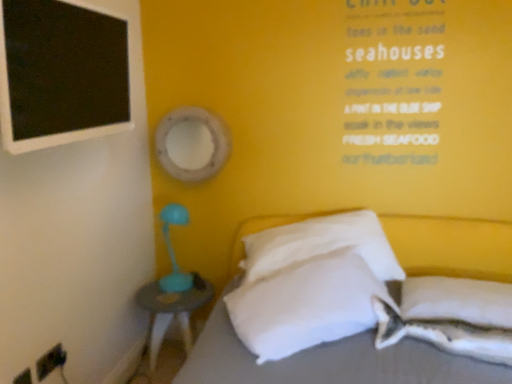
This screenshot has height=384, width=512. What are the coordinates of `white soft pillow at lower right, the 4th pillow from the left` in the screenshot? It's located at (457, 300).

The image size is (512, 384). What do you see at coordinates (329, 362) in the screenshot?
I see `white fabric bed at lower right` at bounding box center [329, 362].

From the picture: Measure the distance between white soft pillow at center, acting as the 4th pillow starting from the right, and camera.

The distance of white soft pillow at center, acting as the 4th pillow starting from the right, from camera is 1.58 meters.

The image size is (512, 384). What do you see at coordinates (62, 73) in the screenshot?
I see `black matte board at upper left` at bounding box center [62, 73].

I want to click on teal plastic nightstand at lower left, so click(x=172, y=311).

Considering the sizes of objects white soft pillow at lower right, which is the third pillow from left to right, and white soft pillow at lower right, the 4th pillow from the left, in the image provided, who is shorter, white soft pillow at lower right, which is the third pillow from left to right, or white soft pillow at lower right, the 4th pillow from the left,?

white soft pillow at lower right, the 4th pillow from the left, is shorter.

Which is more to the right, white soft pillow at lower right, the second pillow from the right, or white soft pillow at lower right, the 4th pillow from the left?

white soft pillow at lower right, the 4th pillow from the left, is more to the right.

Is white soft pillow at lower right, which is the third pillow from left to right, turned away from white soft pillow at lower right, the 1th pillow positioned from the right?

Yes, white soft pillow at lower right, which is the third pillow from left to right, is positioned with its back facing white soft pillow at lower right, the 1th pillow positioned from the right.

Considering the relative sizes of white soft pillow at lower right, which is the third pillow from left to right, and white soft pillow at lower right, the 1th pillow positioned from the right, in the image provided, is white soft pillow at lower right, which is the third pillow from left to right, smaller than white soft pillow at lower right, the 1th pillow positioned from the right,?

Indeed, white soft pillow at lower right, which is the third pillow from left to right, has a smaller size compared to white soft pillow at lower right, the 1th pillow positioned from the right.

Is white fabric bed at lower right closer to the viewer compared to white soft pillow at center, acting as the 4th pillow starting from the right?

That is True.

Who is taller, white fabric bed at lower right or white soft pillow at center, acting as the 4th pillow starting from the right?

With more height is white fabric bed at lower right.

From a real-world perspective, is white fabric bed at lower right on top of white soft pillow at center, the 1th pillow from the left?

No, from a real-world perspective, white fabric bed at lower right is not on top of white soft pillow at center, the 1th pillow from the left.

Relative to white soft pillow at center, the 2th pillow in the left-to-right sequence, is black matte board at upper left in front or behind?

black matte board at upper left is in front of white soft pillow at center, the 2th pillow in the left-to-right sequence.

Is black matte board at upper left oriented away from white soft pillow at center, the 2th pillow in the left-to-right sequence?

No, black matte board at upper left is not facing the opposite direction of white soft pillow at center, the 2th pillow in the left-to-right sequence.

Is black matte board at upper left to the right of white soft pillow at center, which appears as the third pillow when viewed from the right, from the viewer's perspective?

In fact, black matte board at upper left is to the left of white soft pillow at center, which appears as the third pillow when viewed from the right.

From a real-world perspective, which object stands above the other?

black matte board at upper left is physically above.

Are teal plastic nightstand at lower left and white soft pillow at lower right, the 1th pillow positioned from the right, located far from each other?

Absolutely, teal plastic nightstand at lower left is distant from white soft pillow at lower right, the 1th pillow positioned from the right.

From the picture: Can you confirm if teal plastic nightstand at lower left is shorter than white soft pillow at lower right, the 1th pillow positioned from the right?

Incorrect, the height of teal plastic nightstand at lower left does not fall short of that of white soft pillow at lower right, the 1th pillow positioned from the right.

How much distance is there between teal plastic nightstand at lower left and white soft pillow at lower right, the 1th pillow positioned from the right?

teal plastic nightstand at lower left is 4.03 feet from white soft pillow at lower right, the 1th pillow positioned from the right.

Is white soft pillow at center, acting as the 4th pillow starting from the right, at the back of white soft pillow at lower right, the 4th pillow from the left?

No, white soft pillow at center, acting as the 4th pillow starting from the right, is not at the back of white soft pillow at lower right, the 4th pillow from the left.

Can you confirm if white soft pillow at lower right, the 1th pillow positioned from the right, is smaller than white soft pillow at center, the 1th pillow from the left?

Indeed, white soft pillow at lower right, the 1th pillow positioned from the right, has a smaller size compared to white soft pillow at center, the 1th pillow from the left.

In terms of size, does white fabric bed at lower right appear bigger or smaller than white soft pillow at lower right, which is the third pillow from left to right?

In the image, white fabric bed at lower right appears to be larger than white soft pillow at lower right, which is the third pillow from left to right.

Considering the relative sizes of white fabric bed at lower right and white soft pillow at lower right, the second pillow from the right, in the image provided, is white fabric bed at lower right shorter than white soft pillow at lower right, the second pillow from the right,?

Incorrect, the height of white fabric bed at lower right does not fall short of that of white soft pillow at lower right, the second pillow from the right.

Does white fabric bed at lower right have a lesser width compared to white soft pillow at lower right, the second pillow from the right?

No.

Who is taller, white soft pillow at center, acting as the 4th pillow starting from the right, or white fabric bed at lower right?

white fabric bed at lower right.

Does white soft pillow at center, acting as the 4th pillow starting from the right, have a larger size compared to white fabric bed at lower right?

No.

Is white soft pillow at center, acting as the 4th pillow starting from the right, oriented towards white fabric bed at lower right?

Yes, white soft pillow at center, acting as the 4th pillow starting from the right, is oriented towards white fabric bed at lower right.

Which object is further away from the camera, white soft pillow at center, the 1th pillow from the left, or white fabric bed at lower right?

white soft pillow at center, the 1th pillow from the left, is more distant.

This screenshot has width=512, height=384. What are the coordinates of `the 1st pillow positioned above the white soft pillow at lower right, the second pillow from the right (from a real-world perspective)` in the screenshot? It's located at (457, 300).

Locate an element on the screen. This screenshot has width=512, height=384. bed lying below the white soft pillow at center, the 1th pillow from the left (from the image's perspective) is located at coordinates (329, 362).

Looking at the image, which one is located further to white fabric bed at lower right, black matte board at upper left or white soft pillow at lower right, the 1th pillow positioned from the right?

Based on the image, black matte board at upper left appears to be further to white fabric bed at lower right.

From the image, which object appears to be nearer to white soft pillow at lower right, which is the third pillow from left to right, teal plastic nightstand at lower left or white soft pillow at lower right, the 4th pillow from the left?

white soft pillow at lower right, the 4th pillow from the left.

Based on their spatial positions, is black matte board at upper left or white fabric bed at lower right closer to white soft pillow at center, acting as the 4th pillow starting from the right?

white fabric bed at lower right.

Consider the image. Looking at the image, which one is located closer to white soft pillow at lower right, the 4th pillow from the left, black matte board at upper left or white soft pillow at lower right, the second pillow from the right?

white soft pillow at lower right, the second pillow from the right.

From the image, which object appears to be nearer to white soft pillow at lower right, the 1th pillow positioned from the right, teal plastic nightstand at lower left or black matte board at upper left?

teal plastic nightstand at lower left.

Looking at the image, which one is located further to white soft pillow at center, acting as the 4th pillow starting from the right, teal plastic nightstand at lower left or white fabric bed at lower right?

Based on the image, teal plastic nightstand at lower left appears to be further to white soft pillow at center, acting as the 4th pillow starting from the right.

Considering their positions, is teal plastic nightstand at lower left positioned further to black matte board at upper left than white soft pillow at lower right, the 4th pillow from the left?

The object further to black matte board at upper left is white soft pillow at lower right, the 4th pillow from the left.

Consider the image. Estimate the real-world distances between objects in this image. Which object is further from teal plastic nightstand at lower left, white soft pillow at center, the 1th pillow from the left, or white fabric bed at lower right?

The object further to teal plastic nightstand at lower left is white soft pillow at center, the 1th pillow from the left.

You are a GUI agent. You are given a task and a screenshot of the screen. Output one action in this format:
    pyautogui.click(x=<x>, y=<y>)
    Task: Click on the pillow between white fabric bed at lower right and white soft pillow at center, the 1th pillow from the left, along the z-axis
    This screenshot has width=512, height=384.
    Given the screenshot: What is the action you would take?
    pyautogui.click(x=452, y=317)

Image resolution: width=512 pixels, height=384 pixels. I want to click on bed situated between black matte board at upper left and white soft pillow at lower right, which is the third pillow from left to right, from left to right, so click(x=329, y=362).

Where is `pillow located between white soft pillow at center, the 2th pillow in the left-to-right sequence, and white soft pillow at lower right, the 1th pillow positioned from the right, in the left-right direction`? This screenshot has height=384, width=512. pillow located between white soft pillow at center, the 2th pillow in the left-to-right sequence, and white soft pillow at lower right, the 1th pillow positioned from the right, in the left-right direction is located at coordinates (452, 317).

In order to click on pillow between white soft pillow at center, the 1th pillow from the left, and white soft pillow at lower right, the second pillow from the right, in the horizontal direction in this screenshot , I will do `click(321, 245)`.